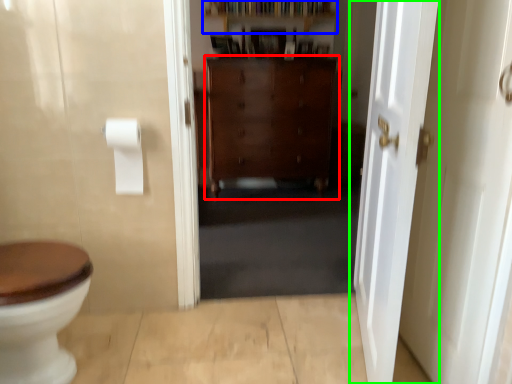
Question: Based on their relative distances, which object is nearer to cabinetry (highlighted by a red box)? Choose from shelf (highlighted by a blue box) and door (highlighted by a green box).

Choices:
 (A) shelf
 (B) door

Answer: (A)